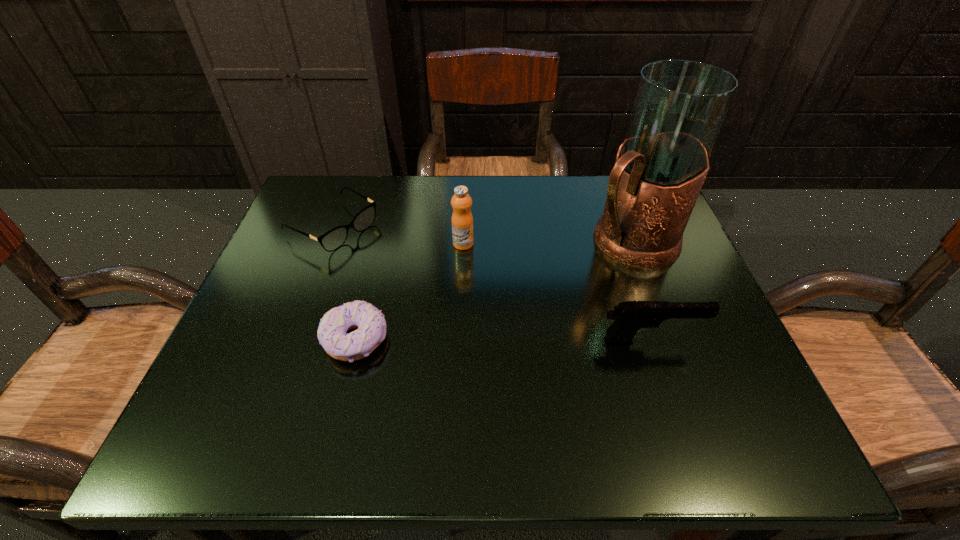
Image resolution: width=960 pixels, height=540 pixels. I want to click on free spot on the desktop that is between the doughnut and the pistol and is positioned with the handle on the side of the tallest object, so click(x=493, y=340).

I want to click on vacant spot on the desktop that is between the doughnut and the pistol and is positioned on the front label of the third object from left to right, so click(x=545, y=340).

This screenshot has width=960, height=540. Identify the location of free spot on the desktop that is between the doughnut and the third tallest object and is positioned on the front-facing side of the spectacles. (534, 340).